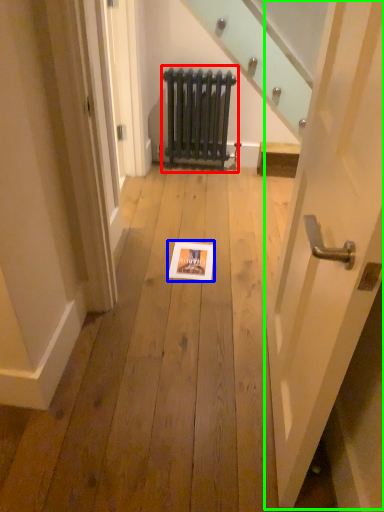
Question: Based on their relative distances, which object is farther from radiator (highlighted by a red box)? Choose from picture frame (highlighted by a blue box) and door (highlighted by a green box).

Choices:
 (A) picture frame
 (B) door

Answer: (B)